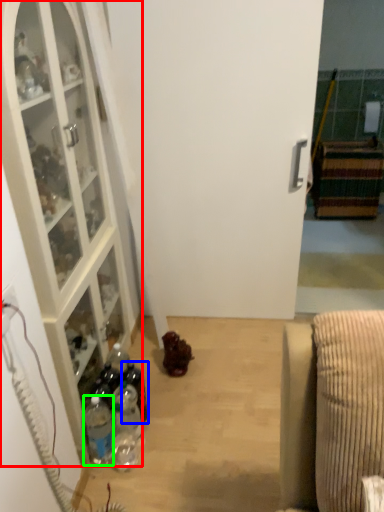
Question: Which is farther away from cabinetry (highlighted by a red box)? bottle (highlighted by a blue box) or bottle (highlighted by a green box)?

Choices:
 (A) bottle
 (B) bottle

Answer: (A)